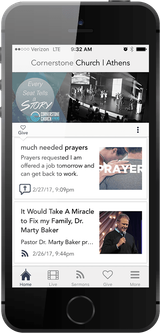
Locate an element on the screen. The width and height of the screenshot is (160, 333). stage is located at coordinates (107, 98).